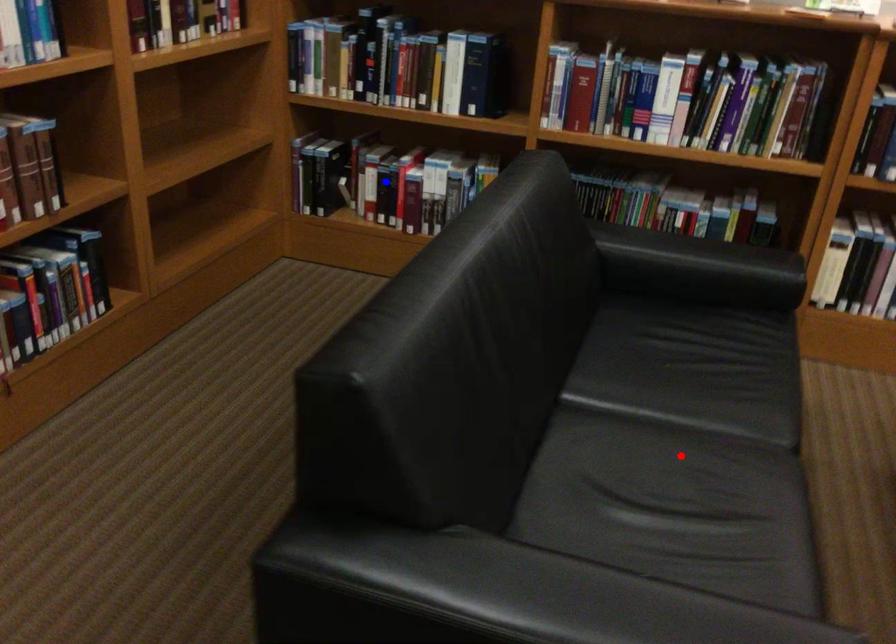
Question: In the image, two points are highlighted. Which point is nearer to the camera? Reply with the corresponding letter.

Choices:
 (A) blue point
 (B) red point

Answer: (B)